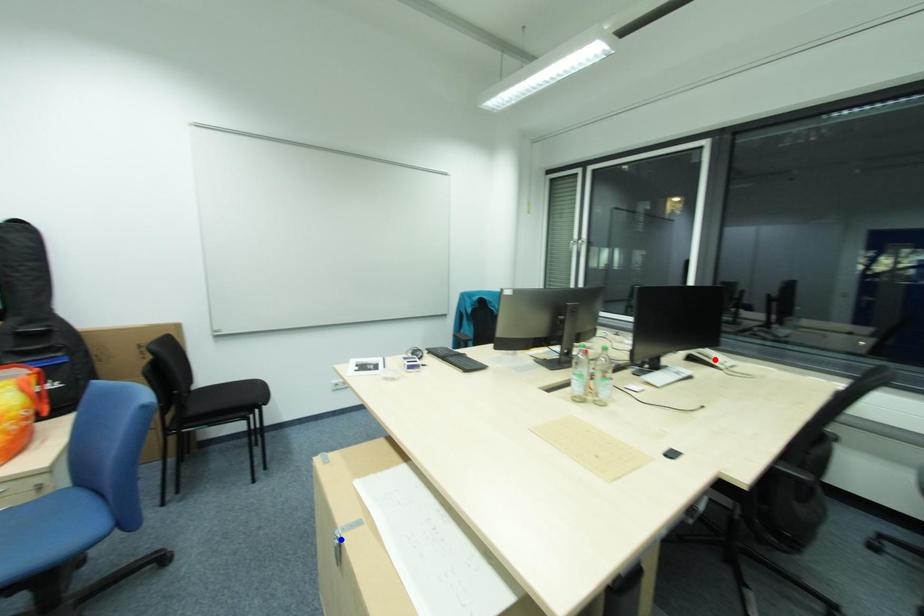
Question: In the image, two points are highlighted. Which point is nearer to the camera? Reply with the corresponding letter.

Choices:
 (A) blue point
 (B) red point

Answer: (A)